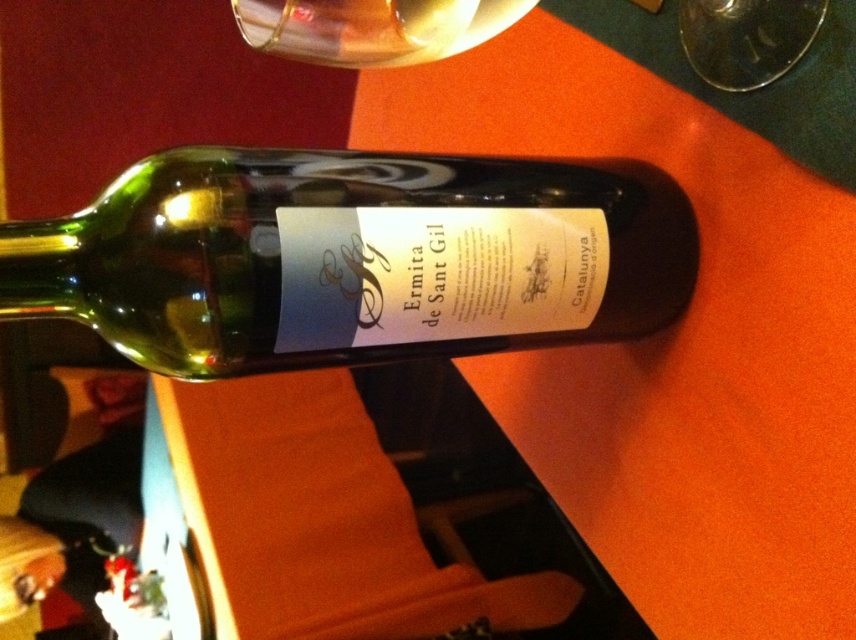
Question: Does orange matte table at center have a smaller size compared to transparent glass at upper right?

Choices:
 (A) yes
 (B) no

Answer: (B)

Question: Which object is closer to the camera taking this photo?

Choices:
 (A) green glass bottle at center
 (B) transparent glass at upper right
 (C) orange matte table at center
 (D) transparent glass at upper center

Answer: (B)

Question: Among these objects, which one is farthest from the camera?

Choices:
 (A) transparent glass at upper center
 (B) orange matte table at center
 (C) green glass bottle at center
 (D) transparent glass at upper right

Answer: (B)

Question: Does orange matte table at center lie behind transparent glass at upper center?

Choices:
 (A) yes
 (B) no

Answer: (A)

Question: Among these objects, which one is farthest from the camera?

Choices:
 (A) transparent glass at upper right
 (B) orange matte table at center
 (C) transparent glass at upper center

Answer: (B)

Question: Can you confirm if orange matte table at center is wider than green glass bottle at center?

Choices:
 (A) no
 (B) yes

Answer: (A)